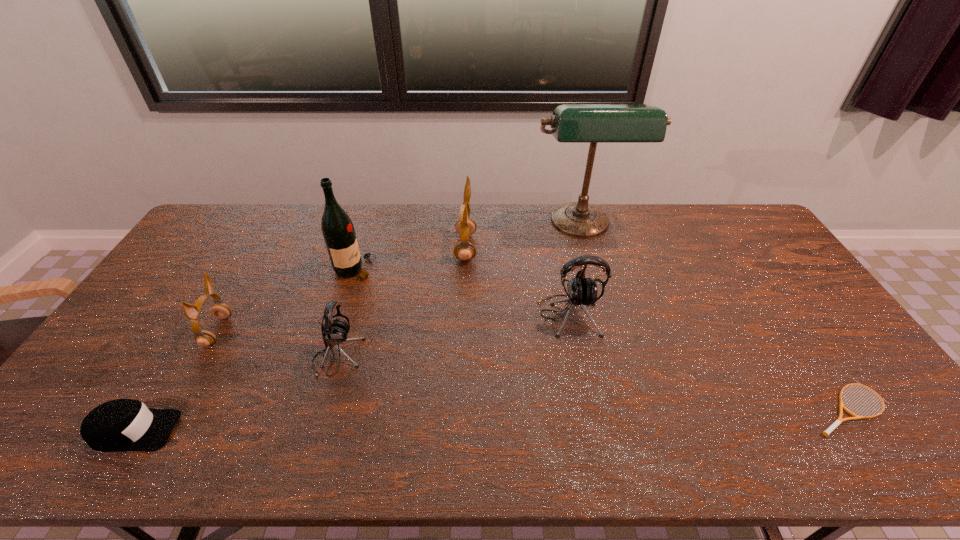
Where is `the left black earphone`? the left black earphone is located at coordinates (335, 331).

Identify the location of the smaller black earphone. (335, 331).

Locate an element on the screen. cap is located at coordinates (119, 425).

Image resolution: width=960 pixels, height=540 pixels. I want to click on black cap, so click(x=119, y=425).

You are a GUI agent. You are given a task and a screenshot of the screen. Output one action in this format:
    pyautogui.click(x=<x>, y=<y>)
    Task: Click on the tennis racket
    
    Given the screenshot: What is the action you would take?
    pyautogui.click(x=826, y=433)

Identify the location of the rightmost object. This screenshot has height=540, width=960. (826, 433).

Find the location of a particular element. The image size is (960, 540). vacant space located 0.320m above the green lampshade of the green table lamp is located at coordinates (608, 320).

Where is `free space located 0.160m on the surface of the green wine bottle`? free space located 0.160m on the surface of the green wine bottle is located at coordinates (423, 269).

Where is `free location located 0.090m on the front-facing side of the right brown earphone`? The height and width of the screenshot is (540, 960). free location located 0.090m on the front-facing side of the right brown earphone is located at coordinates (502, 248).

Where is `blank area located 0.090m on the back of the bigger black earphone`? This screenshot has height=540, width=960. blank area located 0.090m on the back of the bigger black earphone is located at coordinates (561, 275).